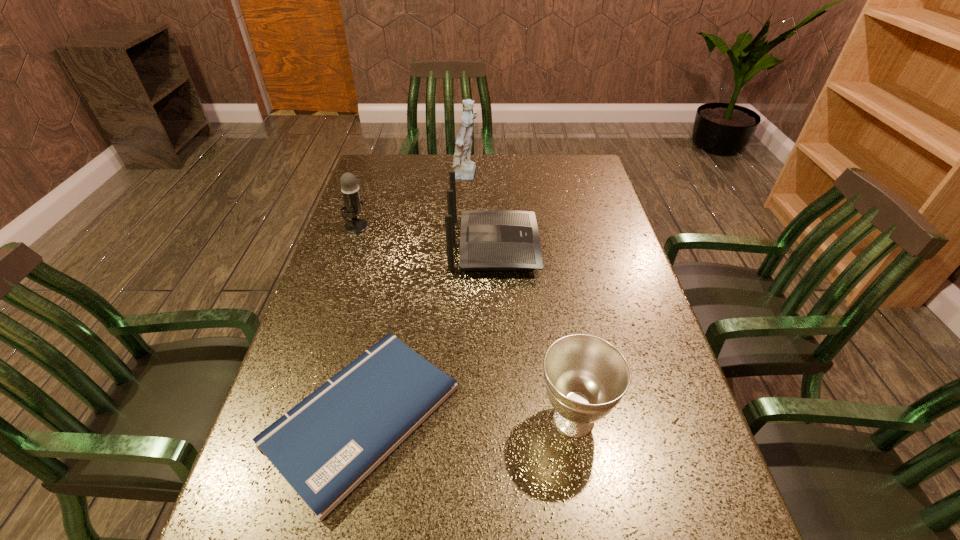
Image resolution: width=960 pixels, height=540 pixels. In order to click on vacant area located on the right of the paperback book in this screenshot , I will do `click(516, 415)`.

The width and height of the screenshot is (960, 540). I want to click on object present at the far edge, so click(x=464, y=169).

Find the location of a particular element. microphone that is at the left edge is located at coordinates (350, 190).

Locate an element on the screen. The width and height of the screenshot is (960, 540). paperback book that is positioned at the left edge is located at coordinates (325, 446).

You are a GUI agent. You are given a task and a screenshot of the screen. Output one action in this format:
    pyautogui.click(x=<x>, y=<y>)
    Task: Click on the object positioned at the right edge
    Image resolution: width=960 pixels, height=540 pixels.
    Given the screenshot: What is the action you would take?
    pyautogui.click(x=586, y=377)

You are a GUI agent. You are given a task and a screenshot of the screen. Output one action in this format:
    pyautogui.click(x=<x>, y=<y>)
    Task: Click on the vacant space at the far edge of the desktop
    This screenshot has height=540, width=960.
    Given the screenshot: What is the action you would take?
    pyautogui.click(x=544, y=162)

In the image, there is a desktop. Identify the location of vacant area at the left edge. This screenshot has height=540, width=960. (393, 214).

In the image, there is a desktop. Where is `vacant space at the right edge`? The image size is (960, 540). vacant space at the right edge is located at coordinates (651, 329).

This screenshot has height=540, width=960. In order to click on free space at the far right corner in this screenshot , I will do `click(592, 155)`.

Locate an element on the screen. The height and width of the screenshot is (540, 960). vacant space that is in between the microphone and the chalice is located at coordinates (465, 322).